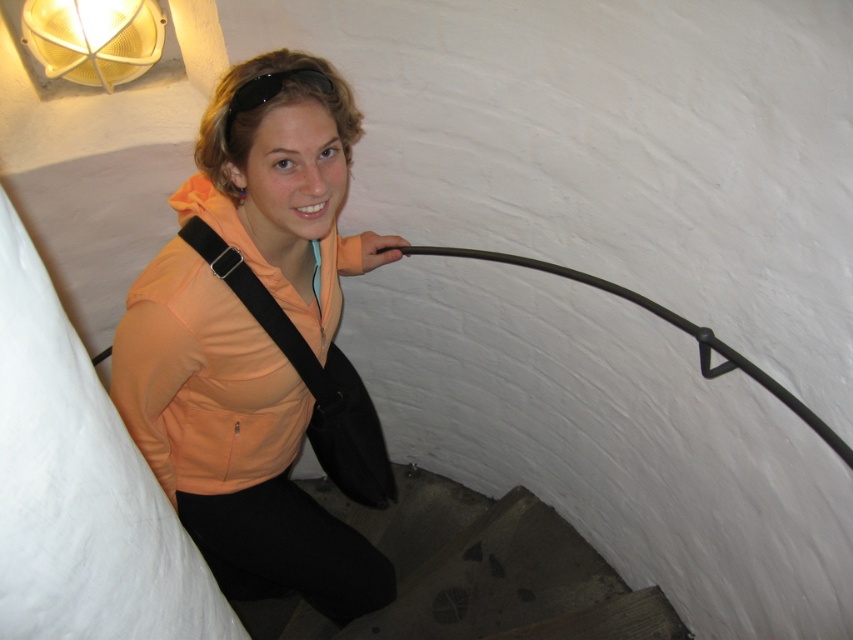
You are standing at the base of the spiral staircase in the image. You need to reach the matte yellow mesh at upper left to retrieve an item. Which direction should you move relative to the dark brown wooden stairs at lower center?

To reach the matte yellow mesh at upper left, you should move upward along the dark brown wooden stairs at lower center since the stairs are located below the mesh.

You are standing at the base of the spiral staircase and want to reach the exit located at the upper left corner of the cylindrical structure. There are two objects in your view, the dark brown wooden stairs at lower center and the matte yellow mesh at upper left. Which object should you focus on to reach the exit?

To reach the exit at the upper left corner, you should focus on the matte yellow mesh at upper left since it is located at the upper left, while the dark brown wooden stairs at lower center are positioned to the right of it.

You are standing at the bottom of the spiral staircase and want to hand a note to the person wearing the orange fabric jacket at center. The dark brown wooden stairs at lower center are in your way. Can you reach them without climbing the stairs?

The orange fabric jacket at center is in front of the dark brown wooden stairs at lower center, so you can reach them by extending your arm over the stairs.